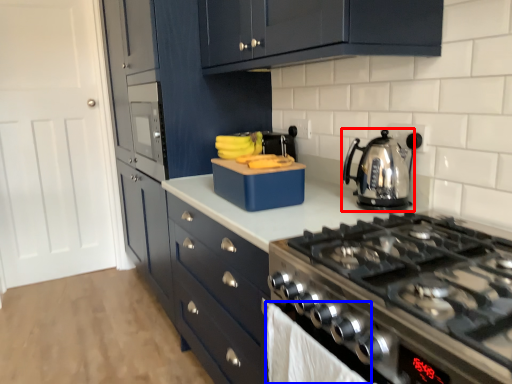
Question: Which object appears closest to the camera in this image, kettle (highlighted by a red box) or cloth (highlighted by a blue box)?

Choices:
 (A) kettle
 (B) cloth

Answer: (B)